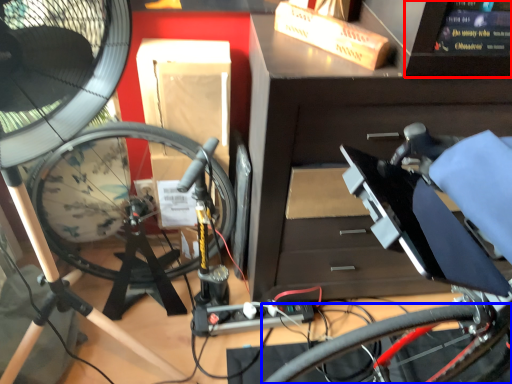
Question: Which object is further to the camera taking this photo, computer screen (highlighted by a red box) or bicycle wheel (highlighted by a blue box)?

Choices:
 (A) computer screen
 (B) bicycle wheel

Answer: (B)